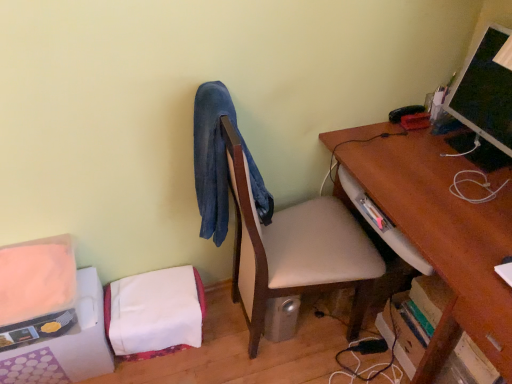
Where is `matte black monitor at upper right`? This screenshot has width=512, height=384. matte black monitor at upper right is located at coordinates (484, 104).

This screenshot has width=512, height=384. I want to click on white fabric at lower left, so click(x=50, y=315).

At what (x,y) coordinates should I click in order to perform the action: click on denim jacket at left. Please return your answer as a coordinate pair (x, y). The width and height of the screenshot is (512, 384). Looking at the image, I should click on (220, 163).

In order to face wooden desk at center-right, should I rotate leftwards or rightwards?

It's best to rotate right around 6.164 degrees.

What is the approximate height of brown wood desk at right?

brown wood desk at right is 30.33 inches in height.

This screenshot has width=512, height=384. What are the coordinates of `matte black monitor at upper right` in the screenshot? It's located at (484, 104).

Which of these two, denim jacket at left or brown wood desk at right, is wider?

Wider between the two is brown wood desk at right.

This screenshot has height=384, width=512. Find the location of `desk on the right of denim jacket at left`. desk on the right of denim jacket at left is located at coordinates (440, 232).

Is brown wood desk at right at the back of denim jacket at left?

No, denim jacket at left's orientation is not away from brown wood desk at right.

From the image's perspective, is denim jacket at left on brown wood desk at right?

Correct, denim jacket at left appears higher than brown wood desk at right in the image.

Which is behind, point (50, 276) or point (203, 165)?

The point (50, 276) is more distant.

How much distance is there between white fabric at lower left and denim jacket at left?

They are 24.87 inches apart.

Who is shorter, white fabric at lower left or denim jacket at left?

Standing shorter between the two is white fabric at lower left.

Considering the sizes of objects white fabric at lower left and denim jacket at left in the image provided, who is smaller, white fabric at lower left or denim jacket at left?

denim jacket at left.

Considering the sizes of objects wooden desk at center-right and matte black monitor at upper right in the image provided, who is taller, wooden desk at center-right or matte black monitor at upper right?

Standing taller between the two is wooden desk at center-right.

Does point (278, 289) appear closer or farther from the camera than point (458, 119)?

Point (278, 289) is closer to the camera than point (458, 119).

This screenshot has height=384, width=512. What are the coordinates of `table on the left of matte black monitor at upper right` in the screenshot? It's located at (295, 250).

Is point (208, 93) positioned in front of point (298, 219)?

That is True.

Between denim jacket at left and wooden desk at center-right, which one has smaller size?

With smaller size is denim jacket at left.

From a real-world perspective, between denim jacket at left and wooden desk at center-right, who is vertically higher?

From a 3D spatial view, denim jacket at left is above.

Is denim jacket at left thinner than matte black monitor at upper right?

No.

Which is behind, denim jacket at left or matte black monitor at upper right?

matte black monitor at upper right.

From a real-world perspective, is denim jacket at left over matte black monitor at upper right?

No, from a real-world perspective, denim jacket at left is not above matte black monitor at upper right.

Is denim jacket at left not inside matte black monitor at upper right?

Indeed, denim jacket at left is completely outside matte black monitor at upper right.

Is wooden desk at center-right positioned before denim jacket at left?

Yes, wooden desk at center-right is closer to the camera.

Do you think wooden desk at center-right is within denim jacket at left, or outside of it?

wooden desk at center-right lies outside denim jacket at left.

Considering the sizes of objects wooden desk at center-right and denim jacket at left in the image provided, who is wider, wooden desk at center-right or denim jacket at left?

With larger width is wooden desk at center-right.

Who is taller, wooden desk at center-right or denim jacket at left?

With more height is wooden desk at center-right.

Identify the location of desk on the right of wooden desk at center-right. (440, 232).

Is brown wood desk at right a part of wooden desk at center-right?

Definitely not — brown wood desk at right is not inside wooden desk at center-right.

From the image's perspective, would you say wooden desk at center-right is positioned over brown wood desk at right?

Yes, from the image's perspective, wooden desk at center-right is above brown wood desk at right.

Find the location of a particular element. The width and height of the screenshot is (512, 384). desk below the denim jacket at left (from the image's perspective) is located at coordinates (440, 232).

Where is `robe above the white fabric at lower left (from the image's perspective)`? This screenshot has width=512, height=384. robe above the white fabric at lower left (from the image's perspective) is located at coordinates (220, 163).

From the image, which object appears to be farther from white fabric at lower left, wooden desk at center-right or brown wood desk at right?

brown wood desk at right.

Looking at the image, which one is located further to brown wood desk at right, white fabric at lower left or denim jacket at left?

white fabric at lower left.

Which object lies nearer to the anchor point brown wood desk at right, matte black monitor at upper right or wooden desk at center-right?

The object closer to brown wood desk at right is matte black monitor at upper right.

Which object lies further to the anchor point wooden desk at center-right, white fabric at lower left or matte black monitor at upper right?

white fabric at lower left.

From the image, which object appears to be nearer to white fabric at lower left, matte black monitor at upper right or brown wood desk at right?

brown wood desk at right is positioned closer to the anchor white fabric at lower left.

Considering their positions, is brown wood desk at right positioned further to white fabric at lower left than wooden desk at center-right?

brown wood desk at right.

Based on their spatial positions, is brown wood desk at right or matte black monitor at upper right further from white fabric at lower left?

Based on the image, matte black monitor at upper right appears to be further to white fabric at lower left.

When comparing their distances from white fabric at lower left, does matte black monitor at upper right or denim jacket at left seem closer?

denim jacket at left.

Locate an element on the screen. The height and width of the screenshot is (384, 512). table between denim jacket at left and brown wood desk at right is located at coordinates (295, 250).

I want to click on desk between white fabric at lower left and matte black monitor at upper right, so click(x=440, y=232).

Find the location of a particular element. The height and width of the screenshot is (384, 512). desk located between wooden desk at center-right and matte black monitor at upper right in the left-right direction is located at coordinates point(440,232).

Identify the location of table located between white fabric at lower left and matte black monitor at upper right in the left-right direction. (295, 250).